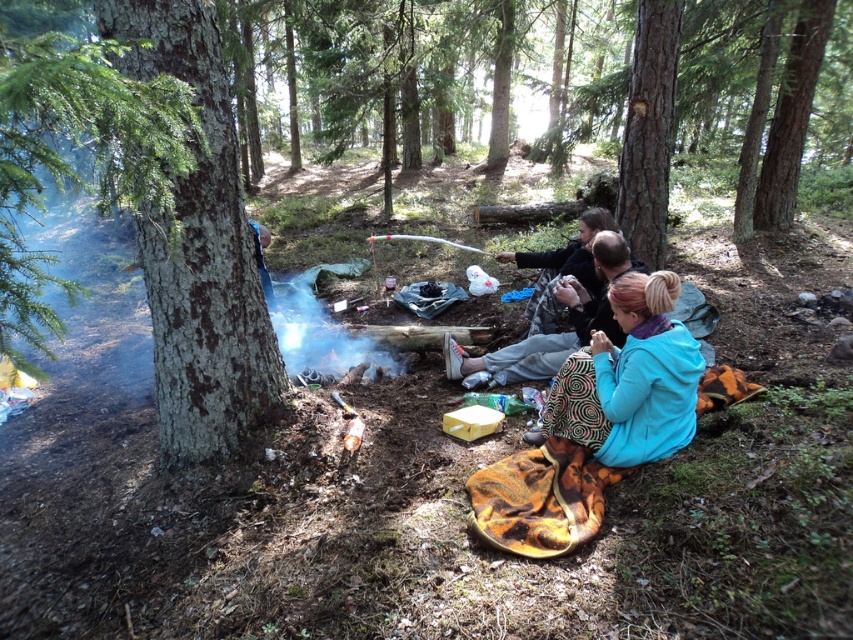
Which is behind, point (485, 362) or point (604, 227)?

The point (485, 362) is more distant.

Does point (624, 244) lie in front of point (610, 221)?

Yes, it is.

The width and height of the screenshot is (853, 640). What do you see at coordinates (558, 332) in the screenshot?
I see `matte black jacket at center` at bounding box center [558, 332].

Image resolution: width=853 pixels, height=640 pixels. What are the coordinates of `matte black jacket at center` in the screenshot? It's located at (558, 332).

In the scene shown: Is teal fabric jacket at lower right to the left of matte black jacket at center from the viewer's perspective?

Incorrect, teal fabric jacket at lower right is not on the left side of matte black jacket at center.

Is point (619, 403) in front of point (625, 268)?

Yes, it is in front of point (625, 268).

Where is `teal fabric jacket at lower right`? teal fabric jacket at lower right is located at coordinates (630, 380).

Where is `teal fabric jacket at lower right`? This screenshot has height=640, width=853. teal fabric jacket at lower right is located at coordinates (630, 380).

Which is below, smooth brown tree trunk at center or teal fabric jacket at center?

teal fabric jacket at center is below.

Is point (643, 234) positioned in front of point (529, 328)?

No, it is behind (529, 328).

The width and height of the screenshot is (853, 640). What are the coordinates of `smooth brown tree trunk at center` in the screenshot? It's located at (648, 129).